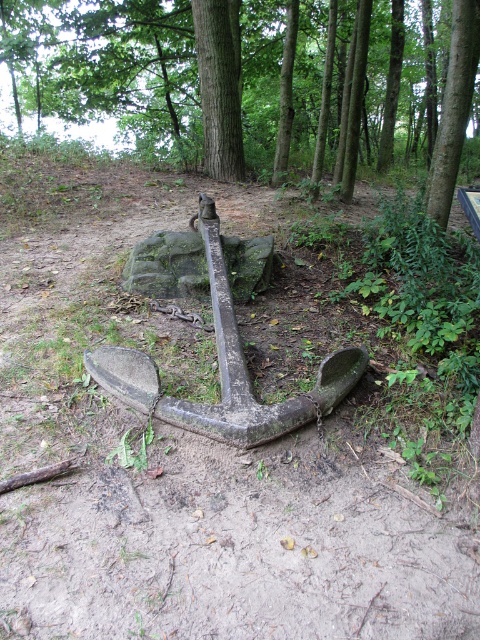
You are a hiker who wants to take a photo of the green rough bark tree at center and the green mossy rock at center. Which one should you stand closer to in order to capture both in the same frame?

Since the green rough bark tree at center is not as tall as the green mossy rock at center, you should stand closer to the green mossy rock at center to include both in the frame.

You are a hiker who has stumbled upon an old anchor in a forest. You notice a point marked at coordinates (256, 81). What object is located at that point?

At point (256, 81) lies the green rough bark tree at center.